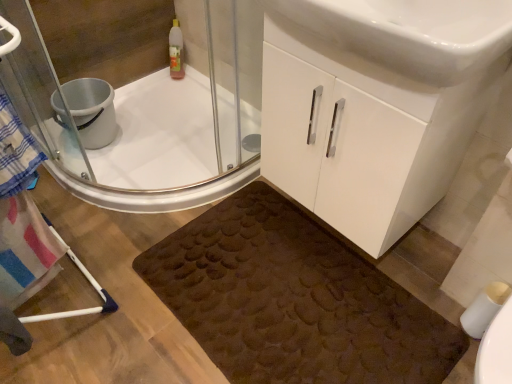
Question: Is brown textured bath mat at lower center completely or partially outside of clear glass shower door at upper left?

Choices:
 (A) yes
 (B) no

Answer: (A)

Question: From a real-world perspective, is brown textured bath mat at lower center beneath clear glass shower door at upper left?

Choices:
 (A) yes
 (B) no

Answer: (A)

Question: Does brown textured bath mat at lower center have a lesser height compared to clear glass shower door at upper left?

Choices:
 (A) yes
 (B) no

Answer: (A)

Question: Is brown textured bath mat at lower center taller than clear glass shower door at upper left?

Choices:
 (A) no
 (B) yes

Answer: (A)

Question: From the image's perspective, is brown textured bath mat at lower center located beneath clear glass shower door at upper left?

Choices:
 (A) yes
 (B) no

Answer: (A)

Question: Considering the relative sizes of brown textured bath mat at lower center and clear glass shower door at upper left in the image provided, is brown textured bath mat at lower center thinner than clear glass shower door at upper left?

Choices:
 (A) no
 (B) yes

Answer: (A)

Question: Can you confirm if brown textured bath mat at lower center is thinner than white matte toilet paper at lower right?

Choices:
 (A) yes
 (B) no

Answer: (B)

Question: Does brown textured bath mat at lower center have a greater height compared to white matte toilet paper at lower right?

Choices:
 (A) no
 (B) yes

Answer: (A)

Question: Considering the relative sizes of brown textured bath mat at lower center and white matte toilet paper at lower right in the image provided, is brown textured bath mat at lower center shorter than white matte toilet paper at lower right?

Choices:
 (A) no
 (B) yes

Answer: (B)

Question: Is brown textured bath mat at lower center facing towards white matte toilet paper at lower right?

Choices:
 (A) no
 (B) yes

Answer: (A)

Question: Could white matte toilet paper at lower right be considered to be inside brown textured bath mat at lower center?

Choices:
 (A) no
 (B) yes

Answer: (A)

Question: Is brown textured bath mat at lower center not within white matte toilet paper at lower right?

Choices:
 (A) yes
 (B) no

Answer: (A)

Question: From a real-world perspective, is white matte toilet paper at lower right on white glossy cabinet at center?

Choices:
 (A) no
 (B) yes

Answer: (A)